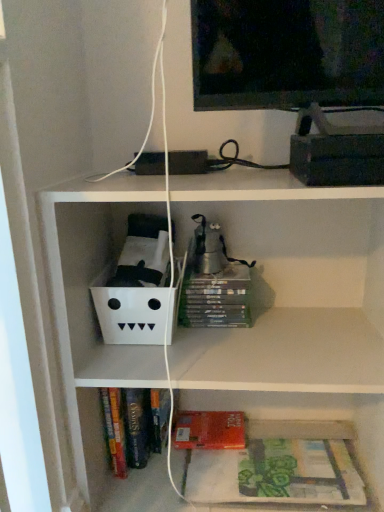
Question: Does point (79, 392) appear closer or farther from the camera than point (240, 455)?

Choices:
 (A) farther
 (B) closer

Answer: (B)

Question: Visually, is hardcover books at lower center positioned to the left or to the right of green matte book at lower right?

Choices:
 (A) right
 (B) left

Answer: (B)

Question: Which is farther from the red matte paperback book at lower center?

Choices:
 (A) green matte book at lower right
 (B) hardcover books at lower center

Answer: (A)

Question: Considering the real-world distances, which object is closest to the red matte paperback book at lower center?

Choices:
 (A) hardcover books at lower center
 (B) green matte book at lower right

Answer: (A)